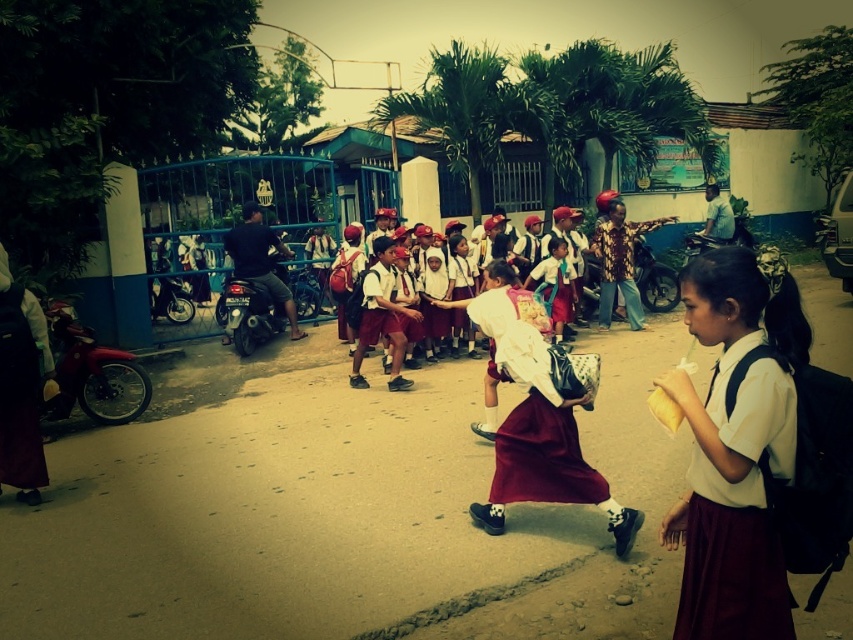
You are a photographer standing at the center of the scene. You want to take a photo that includes both the maroon fabric dress at lower right and the maroon skirt at center. What is the minimum distance you need to move backward to ensure both are fully visible in your frame?

The maroon fabric dress at lower right and maroon skirt at center are 5.90 feet apart. To include both in the frame, you need to move backward at least 5.90 feet to ensure the entire distance between them fits within your camera view.

You are a photographer trying to capture a clear shot of the maroon skirt at center and the maroon satin dress at center. Since you want to focus on both items equally, which one should you zoom in on more to ensure both are in focus?

The maroon skirt at center is bigger than the maroon satin dress at center, so you should zoom in more on the maroon satin dress at center to balance their sizes and keep both in focus.